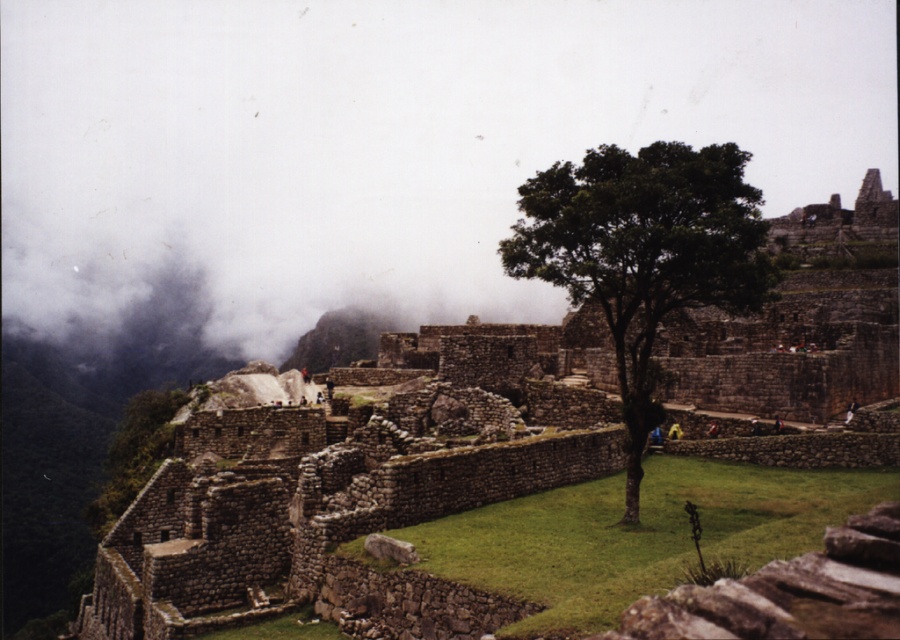
From the picture: You are a photographer at Machu Picchu and want to capture the ancient stone structures without the gray fog at upper left obstructing the view. Based on your current position, is the fog in a position that would block the main ruins in your shot?

The gray fog at upper left is located at point (382, 144), which might block part of the main ruins depending on your camera angle and zoom. To avoid obstruction, adjust your position or zoom to exclude the fog area from the frame.

You are a photographer planning to capture the entire view of the brown stone ruins at center without any obstruction. Considering the gray fog at upper left, will the fog block the view of the ruins?

The gray fog at upper left is wider than the brown stone ruins at center, so the fog may block parts of the ruins depending on its density and position.